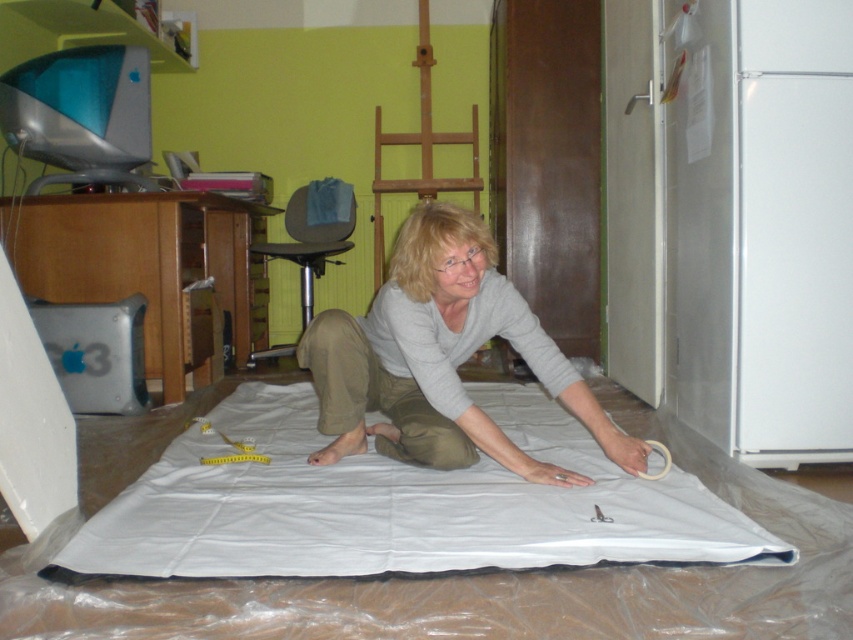
You are a delivery person who needs to place a small package on the floor in the home office. The package must be placed at the point with coordinates point (398, 504). Is this point located on the white fabric at center?

Yes, the point (398, 504) is on the white fabric at center, so the package can be placed there safely.

You are a tailor working on a project and have both the white fabric at center and the gray cotton shirt at center in front of you. Which item is wider?

The white fabric at center is wider than the gray cotton shirt at center because its width surpasses that of the shirt.